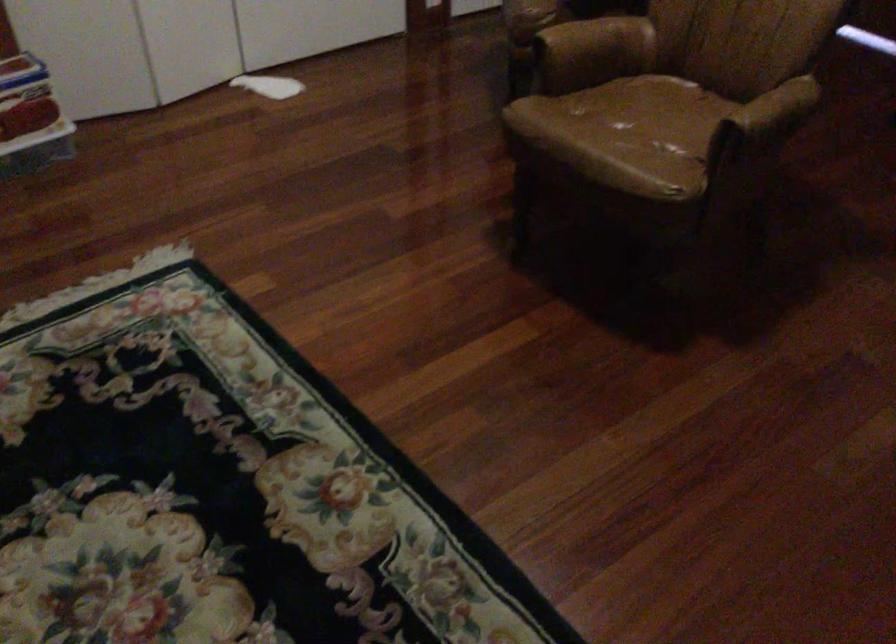
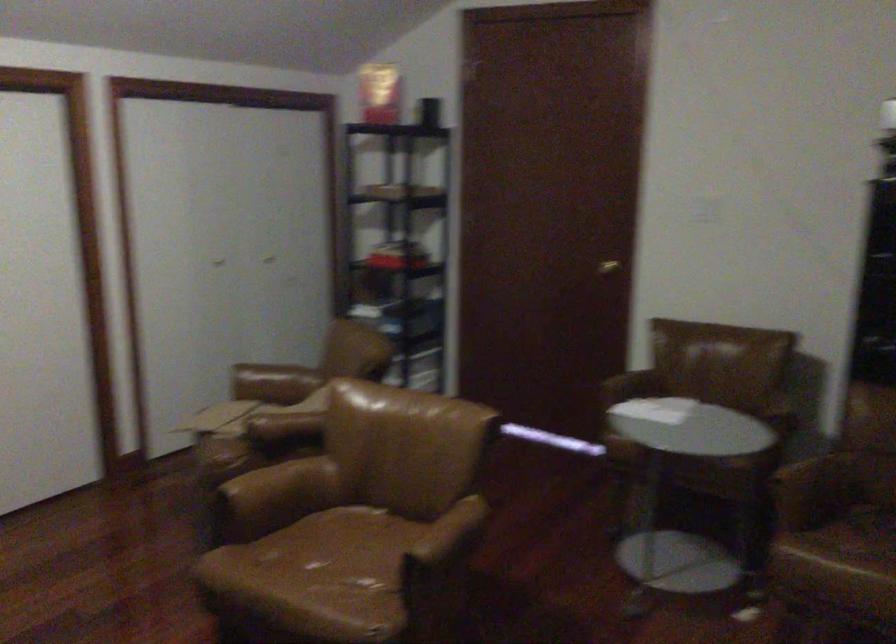
In the second image, find the point that corresponds to the point at 650,118 in the first image.

(343, 556)